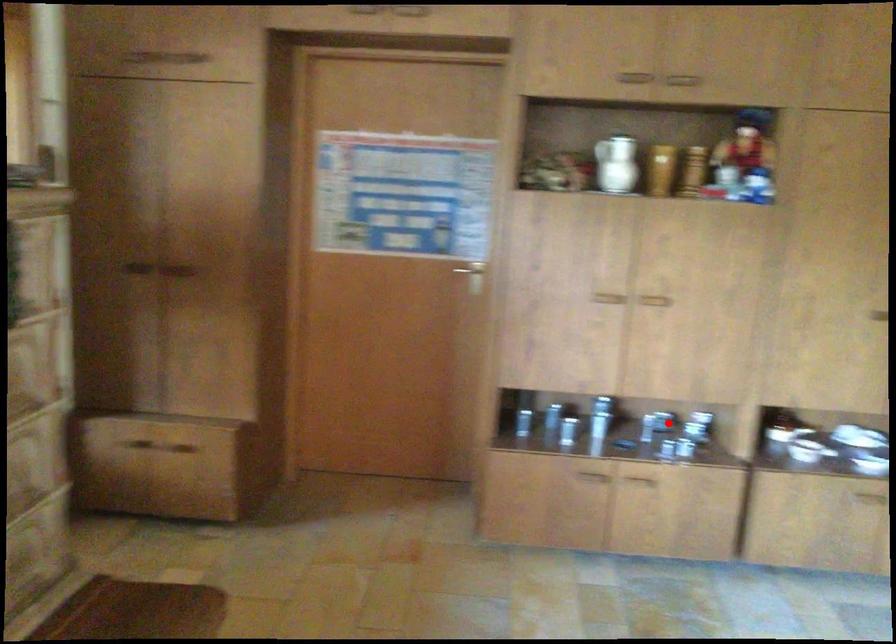
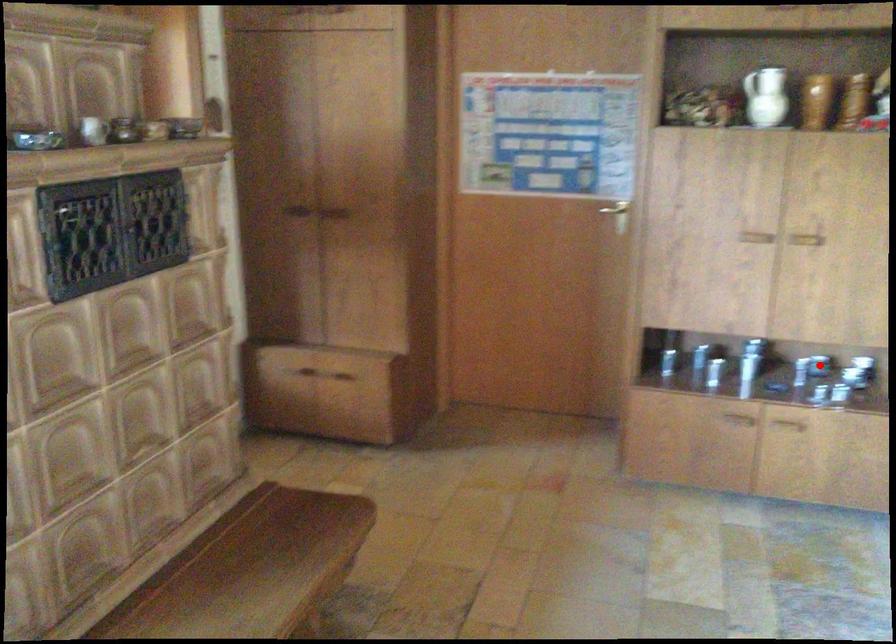
I am providing you with two images of the same scene from different viewpoints. A red point is marked on the first image and another point is marked on the second image. Is the marked point in image1 the same physical position as the marked point in image2?

Yes